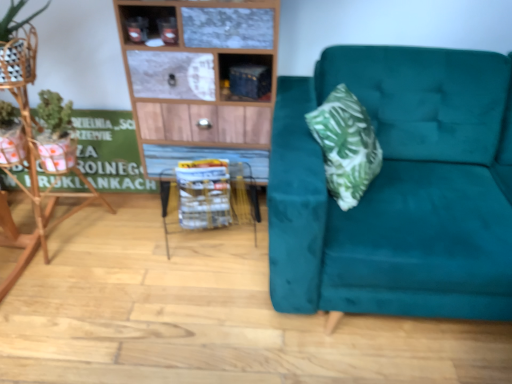
Question: Can metallic blue cabinet at upper center be found inside metallic wireframe table at center?

Choices:
 (A) yes
 (B) no

Answer: (B)

Question: Does metallic wireframe table at center have a lesser width compared to metallic blue cabinet at upper center?

Choices:
 (A) no
 (B) yes

Answer: (A)

Question: Considering the relative positions of metallic wireframe table at center and metallic blue cabinet at upper center in the image provided, is metallic wireframe table at center to the right of metallic blue cabinet at upper center from the viewer's perspective?

Choices:
 (A) yes
 (B) no

Answer: (B)

Question: Can you confirm if metallic wireframe table at center is bigger than metallic blue cabinet at upper center?

Choices:
 (A) yes
 (B) no

Answer: (A)

Question: Can you confirm if metallic wireframe table at center is taller than metallic blue cabinet at upper center?

Choices:
 (A) yes
 (B) no

Answer: (A)

Question: Considering the relative positions of teal velvet couch at right and metallic wireframe table at center in the image provided, is teal velvet couch at right to the left or to the right of metallic wireframe table at center?

Choices:
 (A) right
 (B) left

Answer: (A)

Question: Is teal velvet couch at right in front of or behind metallic wireframe table at center in the image?

Choices:
 (A) front
 (B) behind

Answer: (A)

Question: Is teal velvet couch at right bigger or smaller than metallic wireframe table at center?

Choices:
 (A) big
 (B) small

Answer: (A)

Question: In terms of width, does teal velvet couch at right look wider or thinner when compared to metallic wireframe table at center?

Choices:
 (A) wide
 (B) thin

Answer: (A)

Question: From the image's perspective, is white plastic basket at center located above or below metallic blue cabinet at upper center?

Choices:
 (A) above
 (B) below

Answer: (B)

Question: Considering their positions, is white plastic basket at center located in front of or behind metallic blue cabinet at upper center?

Choices:
 (A) behind
 (B) front

Answer: (A)

Question: Is white plastic basket at center inside the boundaries of metallic blue cabinet at upper center, or outside?

Choices:
 (A) outside
 (B) inside

Answer: (A)

Question: From a real-world perspective, is white plastic basket at center above or below metallic blue cabinet at upper center?

Choices:
 (A) below
 (B) above

Answer: (A)

Question: Considering the relative positions of metallic wireframe table at center and teal velvet couch at right in the image provided, is metallic wireframe table at center to the left or to the right of teal velvet couch at right?

Choices:
 (A) left
 (B) right

Answer: (A)

Question: Is metallic wireframe table at center inside the boundaries of teal velvet couch at right, or outside?

Choices:
 (A) inside
 (B) outside

Answer: (B)